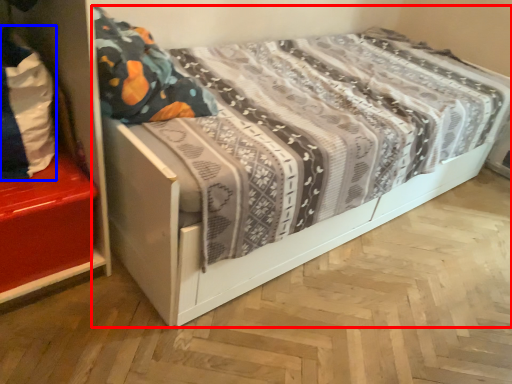
Question: Which of the following is the farthest to the observer, bed (highlighted by a red box) or material (highlighted by a blue box)?

Choices:
 (A) bed
 (B) material

Answer: (B)